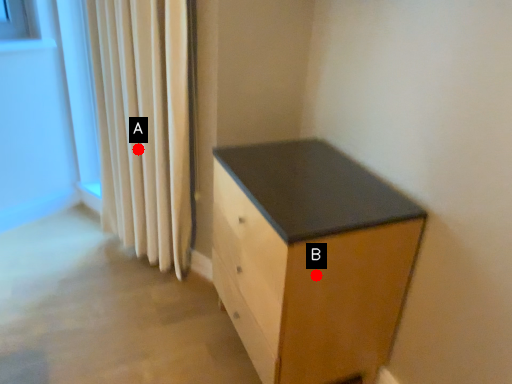
Question: Two points are circled on the image, labeled by A and B beside each circle. Which of the following is the closest to the observer?

Choices:
 (A) A is closer
 (B) B is closer

Answer: (B)